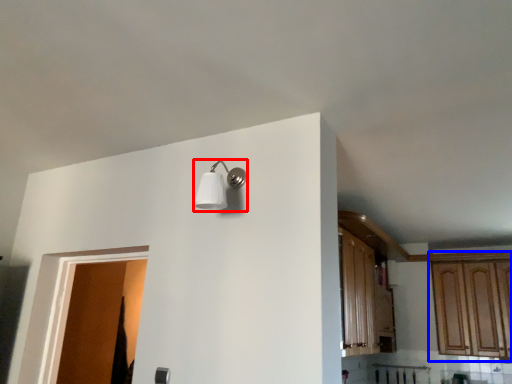
Question: Which object appears closest to the camera in this image, light fixture (highlighted by a red box) or cabinetry (highlighted by a blue box)?

Choices:
 (A) light fixture
 (B) cabinetry

Answer: (A)